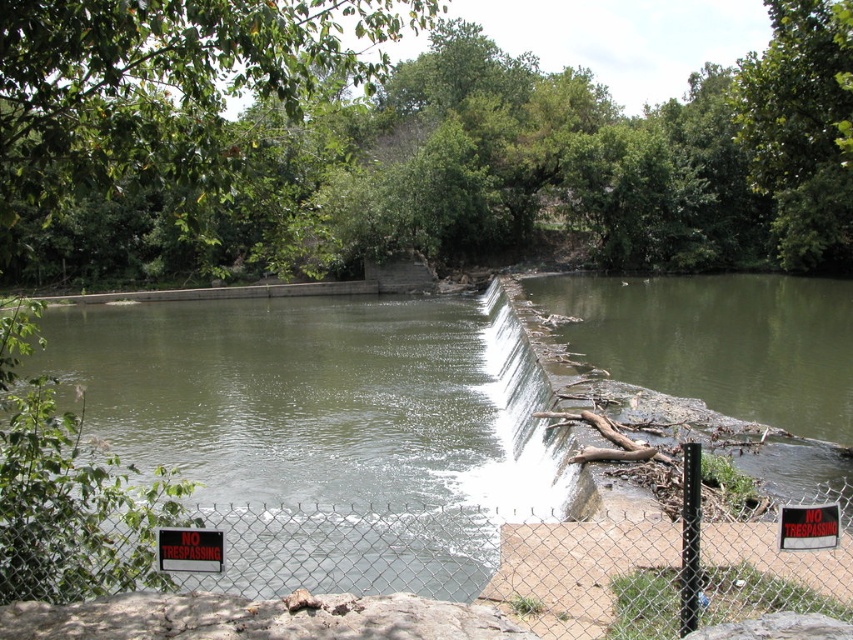
Question: Which point is closer to the camera taking this photo?

Choices:
 (A) 540,454
 (B) 270,452
 (C) 177,557
 (D) 635,609

Answer: (C)

Question: Does green concrete dam at center have a lesser width compared to black plastic sign at lower center?

Choices:
 (A) yes
 (B) no

Answer: (B)

Question: Which object is positioned farthest from the green concrete dam at center?

Choices:
 (A) white concrete waterfall at center
 (B) chain-link fence at center
 (C) black plastic sign at center
 (D) black plastic sign at lower center

Answer: (C)

Question: Is chain-link fence at center behind black plastic sign at lower center?

Choices:
 (A) no
 (B) yes

Answer: (A)

Question: Can you confirm if metal chain-link fence at lower center is smaller than chain-link fence at center?

Choices:
 (A) yes
 (B) no

Answer: (B)

Question: Which point is closer to the camera?

Choices:
 (A) black plastic sign at lower center
 (B) metal chain-link fence at lower center
 (C) black plastic sign at center
 (D) green concrete dam at center

Answer: (B)